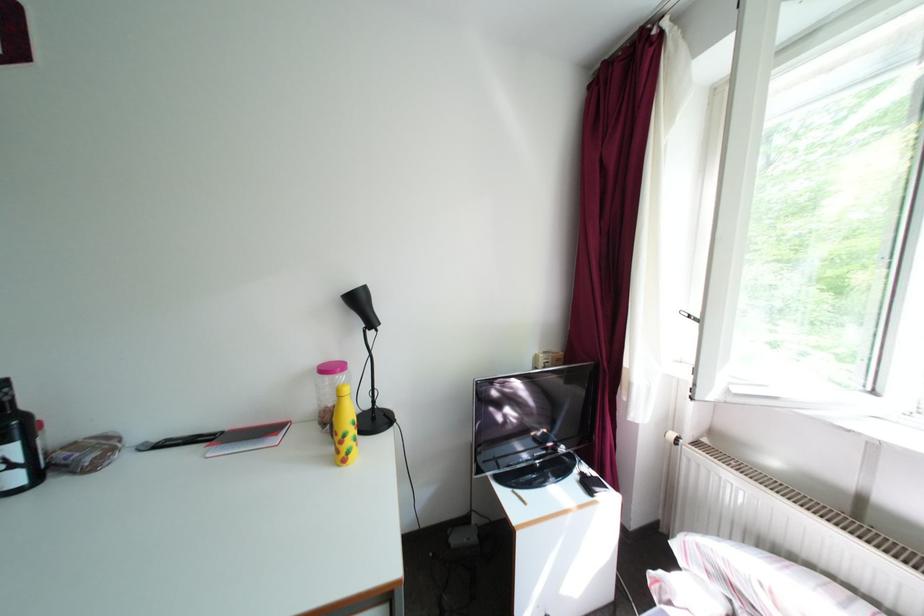
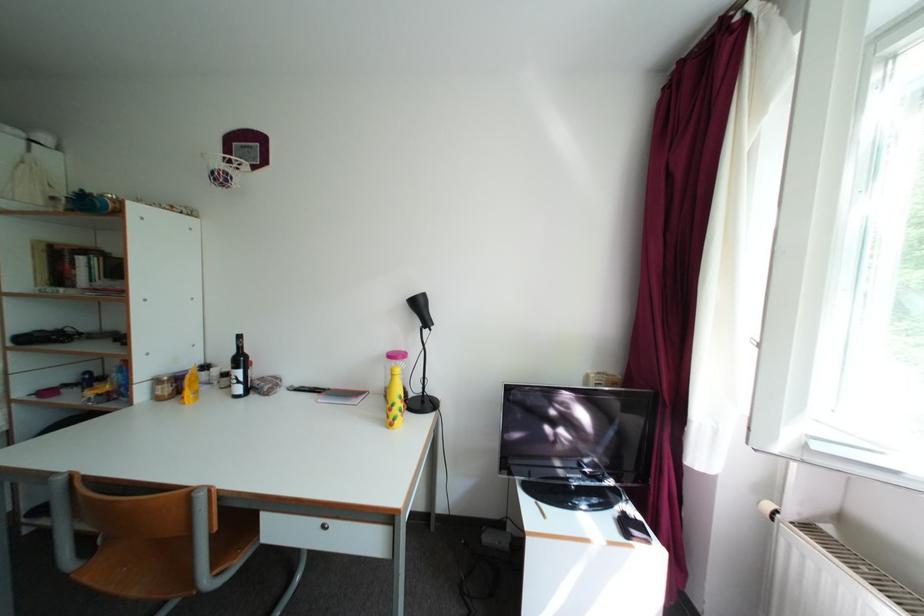
The images are taken continuously from a first-person perspective. In which direction are you moving?

The cameraman moved toward right, backward.